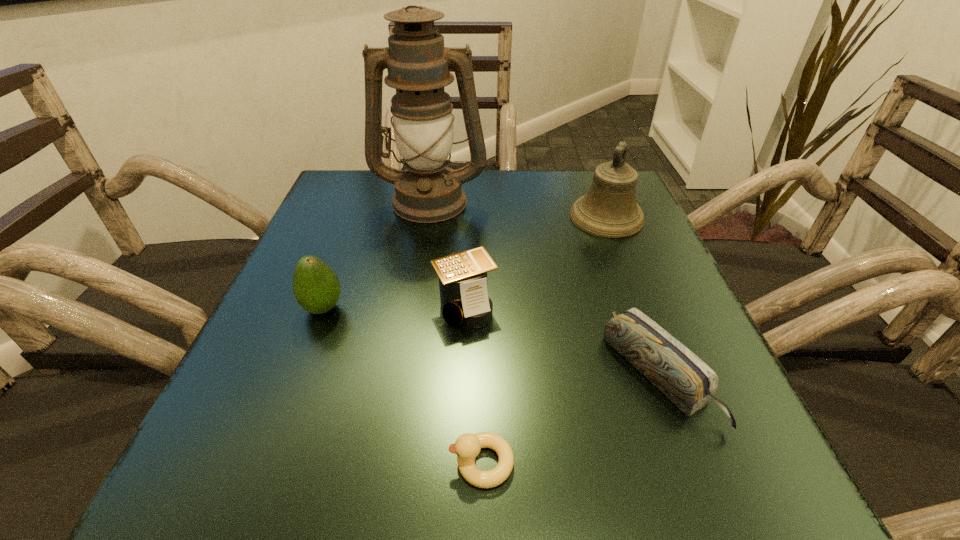
Image resolution: width=960 pixels, height=540 pixels. I want to click on oil lamp, so click(418, 64).

What are the coordinates of `the second tallest object` in the screenshot? It's located at (609, 209).

Identify the location of avocado. (316, 287).

You are a GUI agent. You are given a task and a screenshot of the screen. Output one action in this format:
    pyautogui.click(x=<x>, y=<y>)
    Task: Click on the calculator
    This screenshot has width=960, height=540.
    Given the screenshot: What is the action you would take?
    pyautogui.click(x=464, y=299)

I want to click on pencil box, so click(688, 382).

The height and width of the screenshot is (540, 960). Find the location of `the shortest object`. the shortest object is located at coordinates (467, 447).

Identify the location of vacant space positioned 0.050m on the left of the oil lamp. The height and width of the screenshot is (540, 960). (352, 200).

Where is `free region located on the front of the bell`? free region located on the front of the bell is located at coordinates (646, 319).

I want to click on blank space located 0.390m on the right of the avocado, so click(x=571, y=308).

You are a GUI agent. You are given a task and a screenshot of the screen. Output one action in this format:
    pyautogui.click(x=<x>, y=<y>)
    Task: Click on the free space located on the left of the fourth tallest object
    Image resolution: width=960 pixels, height=540 pixels.
    Given the screenshot: What is the action you would take?
    pyautogui.click(x=358, y=306)